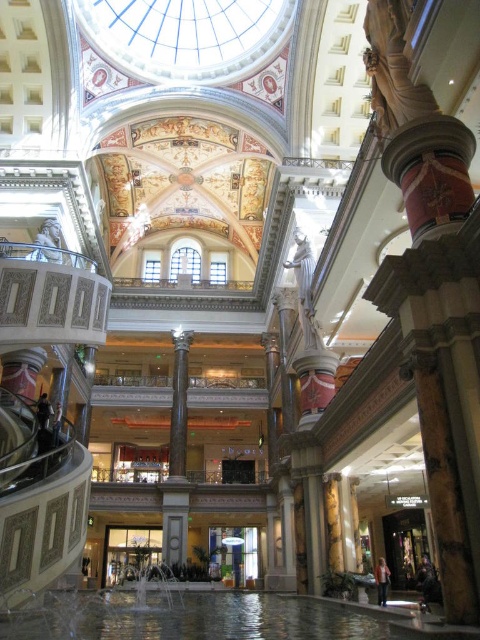
Question: Is black marble column at center wider than white marble statue at center?

Choices:
 (A) yes
 (B) no

Answer: (A)

Question: Can you confirm if black marble column at center is positioned above white marble statue at center?

Choices:
 (A) yes
 (B) no

Answer: (B)

Question: Does black marble column at center have a greater width compared to white marble statue at center?

Choices:
 (A) yes
 (B) no

Answer: (A)

Question: Which point is closer to the camera?

Choices:
 (A) white marble statue at center
 (B) black marble column at center

Answer: (A)

Question: Which of the following is the farthest from the observer?

Choices:
 (A) black marble column at center
 (B) white marble statue at center

Answer: (A)